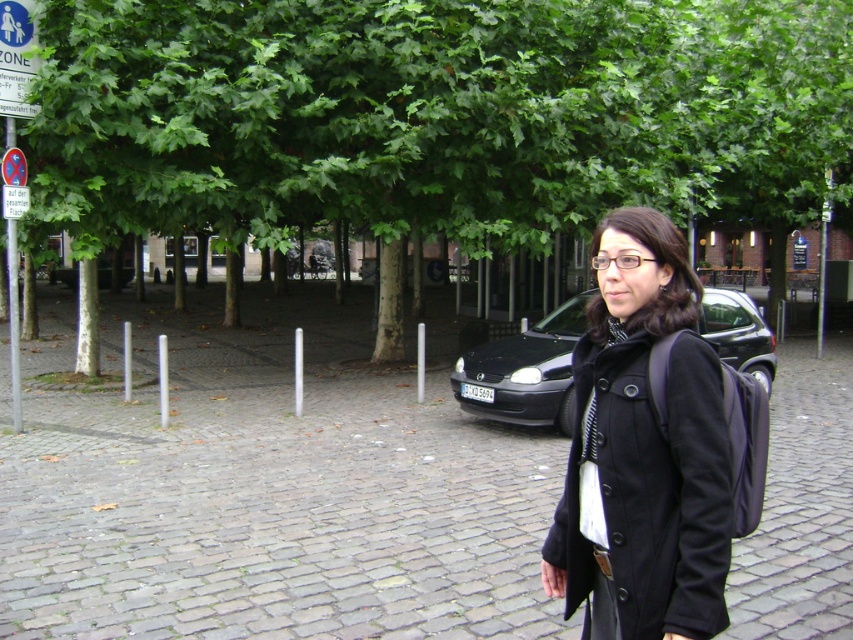
Which of these two, black matte coat at center or metallic pole at left, stands taller?

With more height is metallic pole at left.

Who is shorter, black matte coat at center or metallic pole at left?

With less height is black matte coat at center.

Who is more forward, (703,374) or (19,362)?

Positioned in front is point (703,374).

The height and width of the screenshot is (640, 853). I want to click on black matte coat at center, so click(x=643, y=451).

Is black matte car at center shorter than metallic pole at left?

Yes.

Is point (560, 417) farther from viewer compared to point (9, 232)?

No, (560, 417) is in front of (9, 232).

Where is `black matte car at center`? The image size is (853, 640). black matte car at center is located at coordinates (525, 371).

Does gray cobblestone pavement at center have a larger size compared to metallic pole at left?

Correct, gray cobblestone pavement at center is larger in size than metallic pole at left.

I want to click on gray cobblestone pavement at center, so click(x=270, y=497).

Is point (527, 435) less distant than point (9, 278)?

That is True.

Locate an element on the screen. This screenshot has width=853, height=640. gray cobblestone pavement at center is located at coordinates (270, 497).